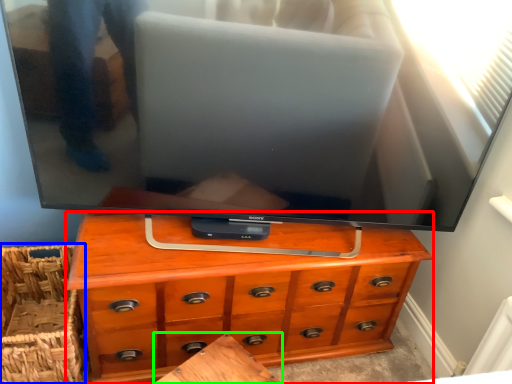
Question: Based on their relative distances, which object is farther from chest of drawers (highlighted by a red box)? Choose from basket (highlighted by a blue box) and table (highlighted by a green box).

Choices:
 (A) basket
 (B) table

Answer: (A)